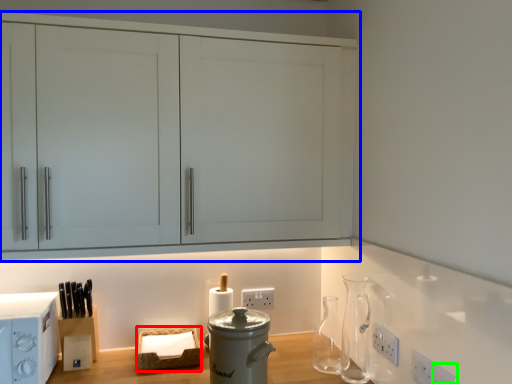
Question: Which object is positioned farthest from basket (highlighted by a red box)? Select from cabinetry (highlighted by a blue box) and electric outlet (highlighted by a green box).

Choices:
 (A) cabinetry
 (B) electric outlet

Answer: (B)